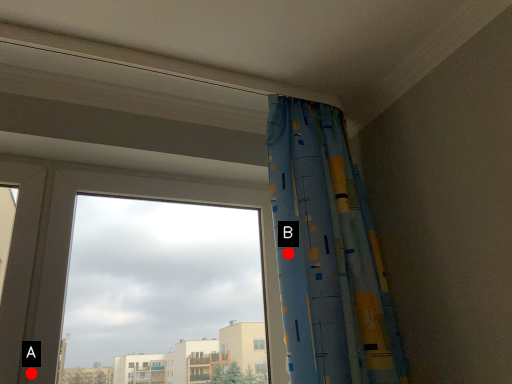
Question: Two points are circled on the image, labeled by A and B beside each circle. Which of the following is the farthest from the observer?

Choices:
 (A) A is further
 (B) B is further

Answer: (B)